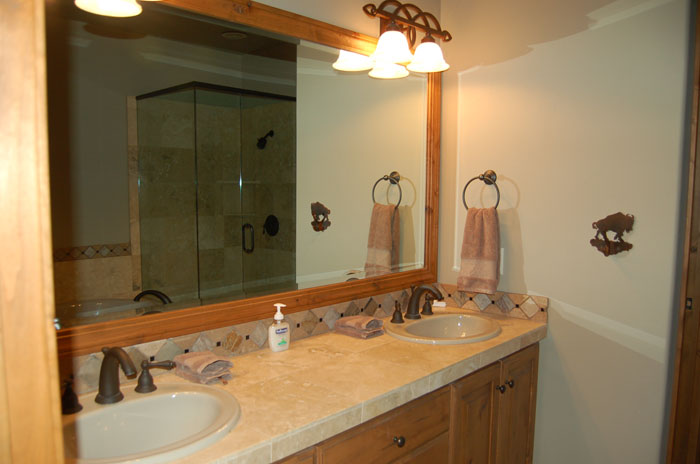
Where is `towel`? towel is located at coordinates (484, 250), (206, 365), (362, 322).